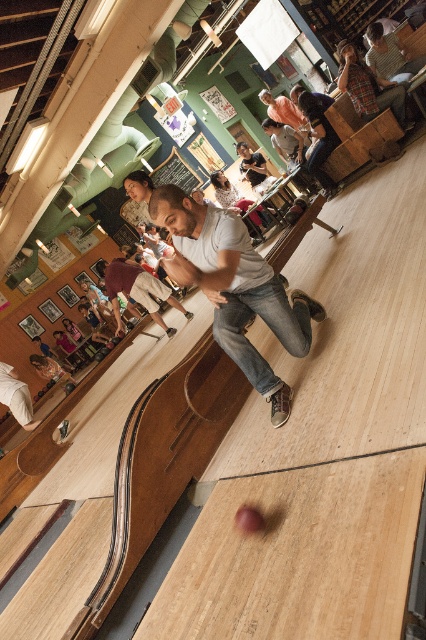
You are a delivery robot with a 3.5 feet wide package. You need to move from the white cotton shirt at lower left to the maroon cotton shirt at center. Can you fit through the space between them?

The distance between the maroon cotton shirt at center and the white cotton shirt at lower left is 5.45 feet. Since the package is 3.5 feet wide, the robot can navigate through the space as the distance is greater than the package width.

You are standing at the starting position on the bowling lane. You see two points marked on the lane, point 1 at coordinates point (114,288) and point 2 at coordinates point (5,387). Which point is closer to the pins at the end of the lane?

Point 1 at coordinates point (114,288) is behind point 2 at coordinates point (5,387), so point 1 is closer to the pins at the end of the lane.